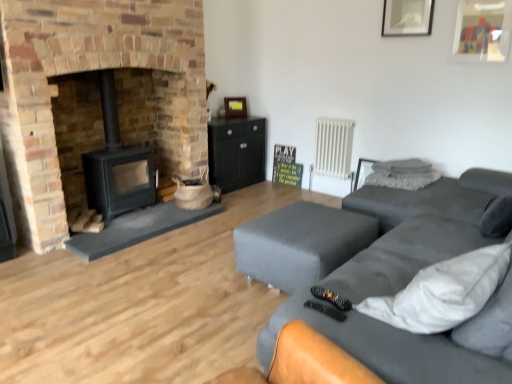
The image size is (512, 384). What do you see at coordinates (403, 168) in the screenshot? I see `white textured pillow at upper right, the 2th pillow in the bottom-to-top sequence` at bounding box center [403, 168].

What do you see at coordinates (301, 243) in the screenshot? I see `matte gray ottoman at lower right` at bounding box center [301, 243].

The height and width of the screenshot is (384, 512). In order to click on wooden picture frame at upper center, marked as the 1th picture frame in a left-to-right arrangement in this screenshot , I will do `click(234, 107)`.

How much space does white textured pillow at upper right, which is the first pillow in bottom-to-top order, occupy horizontally?

The width of white textured pillow at upper right, which is the first pillow in bottom-to-top order, is 20.86 inches.

What are the coordinates of `white textured pillow at upper right, the 2th pillow in the bottom-to-top sequence` in the screenshot? It's located at (403, 168).

Who is bigger, white textured pillow at upper right, the first pillow viewed from the top, or brick fireplace at left?

With larger size is brick fireplace at left.

In terms of height, does white textured pillow at upper right, the 2th pillow in the bottom-to-top sequence, look taller or shorter compared to brick fireplace at left?

Considering their sizes, white textured pillow at upper right, the 2th pillow in the bottom-to-top sequence, has less height than brick fireplace at left.

Would you say brick fireplace at left is part of white textured pillow at upper right, the 2th pillow in the bottom-to-top sequence,'s contents?

Definitely not — brick fireplace at left is not inside white textured pillow at upper right, the 2th pillow in the bottom-to-top sequence.

Find the location of a particular element. The image size is (512, 384). pillow that is the 2nd object to the right of the brick fireplace at left, starting at the anchor is located at coordinates (403, 168).

Considering the sizes of white glossy picture frame at upper right, which ranks as the 2th picture frame in left-to-right order, and white metallic radiator at upper right in the image, is white glossy picture frame at upper right, which ranks as the 2th picture frame in left-to-right order, taller or shorter than white metallic radiator at upper right?

Clearly, white glossy picture frame at upper right, which ranks as the 2th picture frame in left-to-right order, is shorter compared to white metallic radiator at upper right.

In the scene shown: Are white glossy picture frame at upper right, positioned as the first picture frame in right-to-left order, and white metallic radiator at upper right beside each other?

white glossy picture frame at upper right, positioned as the first picture frame in right-to-left order, and white metallic radiator at upper right are not in contact.

Where is `radiator behind the white glossy picture frame at upper right, the 2th picture frame viewed from the back`? This screenshot has width=512, height=384. radiator behind the white glossy picture frame at upper right, the 2th picture frame viewed from the back is located at coordinates (333, 148).

How much distance is there between white glossy picture frame at upper right, which appears as the second picture frame when ordered from the bottom, and white metallic radiator at upper right?

white glossy picture frame at upper right, which appears as the second picture frame when ordered from the bottom, and white metallic radiator at upper right are 1.14 meters apart.

Does black matte wood burning stove at left contain brick fireplace at left?

Actually, brick fireplace at left is outside black matte wood burning stove at left.

Is black matte wood burning stove at left taller than brick fireplace at left?

No.

Can you see black matte wood burning stove at left touching brick fireplace at left?

They are not placed beside each other.

Could you tell me if black matte cabinet at center is turned towards matte gray fabric couch at right?

Yes, black matte cabinet at center is turned towards matte gray fabric couch at right.

Looking at this image, how distant is black matte cabinet at center from matte gray fabric couch at right?

A distance of 1.87 meters exists between black matte cabinet at center and matte gray fabric couch at right.

Based on the photo, is there a large distance between black matte cabinet at center and matte gray fabric couch at right?

Yes, black matte cabinet at center is far from matte gray fabric couch at right.

Is point (262, 174) farther from viewer compared to point (320, 261)?

Yes, it is.

From a real-world perspective, who is located lower, white textured pillow at upper right, the 2th pillow in the bottom-to-top sequence, or white textured pillow at upper right, which ranks as the second pillow in top-to-bottom order?

white textured pillow at upper right, which ranks as the second pillow in top-to-bottom order, is physically lower.

Can you confirm if white textured pillow at upper right, the first pillow viewed from the top, is taller than white textured pillow at upper right, which ranks as the second pillow in top-to-bottom order?

Incorrect, the height of white textured pillow at upper right, the first pillow viewed from the top, is not larger of that of white textured pillow at upper right, which ranks as the second pillow in top-to-bottom order.

The width and height of the screenshot is (512, 384). In order to click on pillow that appears above the white textured pillow at upper right, which ranks as the second pillow in top-to-bottom order (from the image's perspective) in this screenshot , I will do `click(403, 168)`.

Is white textured pillow at upper right, the first pillow viewed from the top, next to white textured pillow at upper right, which ranks as the second pillow in top-to-bottom order, and touching it?

Yes, white textured pillow at upper right, the first pillow viewed from the top, is next to white textured pillow at upper right, which ranks as the second pillow in top-to-bottom order.

Based on the photo, which of these two, white glossy picture frame at upper right, which ranks as the first picture frame in front-to-back order, or white textured pillow at upper right, which ranks as the second pillow in top-to-bottom order, is thinner?

With smaller width is white glossy picture frame at upper right, which ranks as the first picture frame in front-to-back order.

From a real-world perspective, is white glossy picture frame at upper right, the 2th picture frame viewed from the back, positioned under white textured pillow at upper right, which is the first pillow in bottom-to-top order, based on gravity?

Incorrect, from a real-world perspective, white glossy picture frame at upper right, the 2th picture frame viewed from the back, is higher than white textured pillow at upper right, which is the first pillow in bottom-to-top order.

Does point (418, 14) come farther from viewer compared to point (428, 183)?

Yes.

Is white glossy picture frame at upper right, which ranks as the 2th picture frame in left-to-right order, positioned in front of white textured pillow at upper right, which ranks as the second pillow in top-to-bottom order?

No, white glossy picture frame at upper right, which ranks as the 2th picture frame in left-to-right order, is further to the viewer.

Which of these two, white textured pillow at upper right, the first pillow viewed from the top, or matte gray ottoman at lower right, stands shorter?

white textured pillow at upper right, the first pillow viewed from the top, is shorter.

Between white textured pillow at upper right, the 2th pillow in the bottom-to-top sequence, and matte gray ottoman at lower right, which one has smaller size?

white textured pillow at upper right, the 2th pillow in the bottom-to-top sequence.

Does white textured pillow at upper right, the 2th pillow in the bottom-to-top sequence, turn towards matte gray ottoman at lower right?

No.

There is a brick fireplace at left. Where is `the 1st pillow below it (from a real-world perspective)`? The image size is (512, 384). the 1st pillow below it (from a real-world perspective) is located at coordinates (403, 168).

You are a GUI agent. You are given a task and a screenshot of the screen. Output one action in this format:
    pyautogui.click(x=<x>, y=<y>)
    Task: Click on the picture frame in front of the white metallic radiator at upper right
    The height and width of the screenshot is (384, 512).
    Given the screenshot: What is the action you would take?
    pyautogui.click(x=407, y=17)

Which object lies further to the anchor point matte gray ottoman at lower right, wooden picture frame at upper center, the first picture frame positioned from the back, or brick fireplace at left?

Based on the image, wooden picture frame at upper center, the first picture frame positioned from the back, appears to be further to matte gray ottoman at lower right.

Estimate the real-world distances between objects in this image. Which object is further from white textured pillow at upper right, which is the first pillow in bottom-to-top order, matte gray ottoman at lower right or white textured pillow at upper right, the 2th pillow in the bottom-to-top sequence?

matte gray ottoman at lower right is positioned further to the anchor white textured pillow at upper right, which is the first pillow in bottom-to-top order.

When comparing their distances from white glossy picture frame at upper right, which appears as the second picture frame when ordered from the bottom, does matte gray fabric couch at right or white textured pillow at upper right, the first pillow viewed from the top, seem further?

Based on the image, matte gray fabric couch at right appears to be further to white glossy picture frame at upper right, which appears as the second picture frame when ordered from the bottom.

Looking at the image, which one is located further to white textured pillow at upper right, which ranks as the second pillow in top-to-bottom order, black matte cabinet at center or matte gray ottoman at lower right?

black matte cabinet at center lies further to white textured pillow at upper right, which ranks as the second pillow in top-to-bottom order, than the other object.

Consider the image. When comparing their distances from wooden picture frame at upper center, positioned as the 1th picture frame in bottom-to-top order, does white textured pillow at upper right, the first pillow viewed from the top, or black matte wood burning stove at left seem further?

Among the two, white textured pillow at upper right, the first pillow viewed from the top, is located further to wooden picture frame at upper center, positioned as the 1th picture frame in bottom-to-top order.

From the image, which object appears to be nearer to white textured pillow at upper right, which ranks as the second pillow in top-to-bottom order, brick fireplace at left or black matte cabinet at center?

black matte cabinet at center is positioned closer to the anchor white textured pillow at upper right, which ranks as the second pillow in top-to-bottom order.

Which object lies further to the anchor point white metallic radiator at upper right, white textured pillow at upper right, the 2th pillow in the bottom-to-top sequence, or matte gray ottoman at lower right?

Among the two, matte gray ottoman at lower right is located further to white metallic radiator at upper right.

Considering their positions, is white textured pillow at upper right, which is the first pillow in bottom-to-top order, positioned closer to brick fireplace at left than black matte wood burning stove at left?

black matte wood burning stove at left is positioned closer to the anchor brick fireplace at left.

At what (x,y) coordinates should I click in order to perform the action: click on fireplace between matte gray fabric couch at right and wooden picture frame at upper center, which ranks as the second picture frame in top-to-bottom order, along the z-axis. Please return your answer as a coordinate pair (x, y). Image resolution: width=512 pixels, height=384 pixels. Looking at the image, I should click on (95, 70).

Find the location of a particular element. Image resolution: width=512 pixels, height=384 pixels. pillow between black matte cabinet at center and white textured pillow at upper right, the 2th pillow in the bottom-to-top sequence is located at coordinates (402, 179).

Where is `flat located between brick fireplace at left and white textured pillow at upper right, the first pillow viewed from the top, in the left-right direction`? flat located between brick fireplace at left and white textured pillow at upper right, the first pillow viewed from the top, in the left-right direction is located at coordinates (301, 243).

Locate an element on the screen. The height and width of the screenshot is (384, 512). picture frame positioned between matte gray fabric couch at right and wooden picture frame at upper center, positioned as the second picture frame in front-to-back order, from near to far is located at coordinates (407, 17).